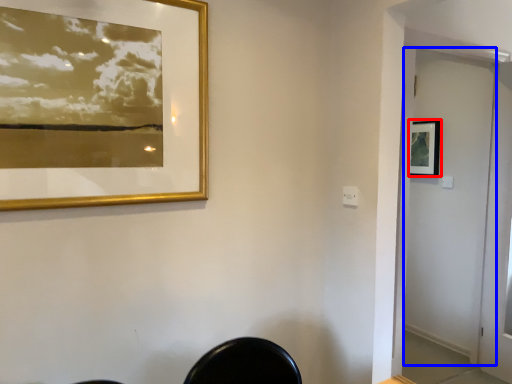
Question: Which of the following is the farthest to the observer, picture frame (highlighted by a red box) or screen door (highlighted by a blue box)?

Choices:
 (A) picture frame
 (B) screen door

Answer: (A)